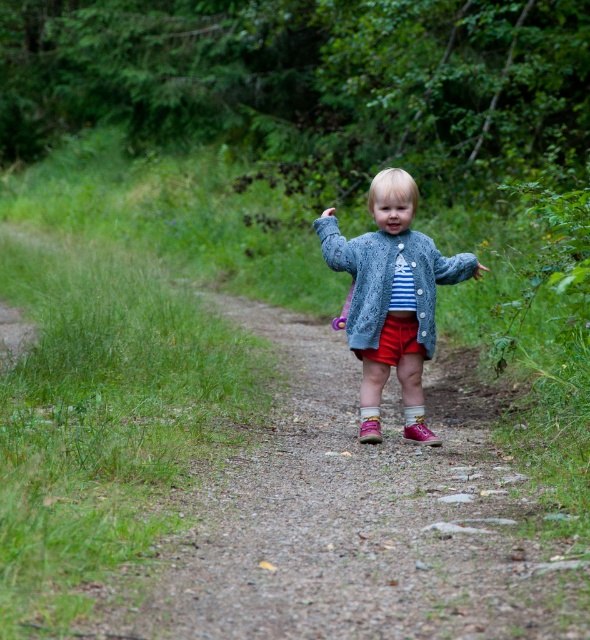
Question: Is knitted blue sweater at center smaller than denim jacket at center?

Choices:
 (A) yes
 (B) no

Answer: (B)

Question: Which of the following is the farthest from the observer?

Choices:
 (A) denim jacket at center
 (B) knitted blue sweater at center

Answer: (A)

Question: Does knitted blue sweater at center appear over denim jacket at center?

Choices:
 (A) yes
 (B) no

Answer: (B)

Question: Among these points, which one is nearest to the camera?

Choices:
 (A) (358, 292)
 (B) (368, 435)

Answer: (A)

Question: Does knitted blue sweater at center have a greater width compared to denim jacket at center?

Choices:
 (A) no
 (B) yes

Answer: (B)